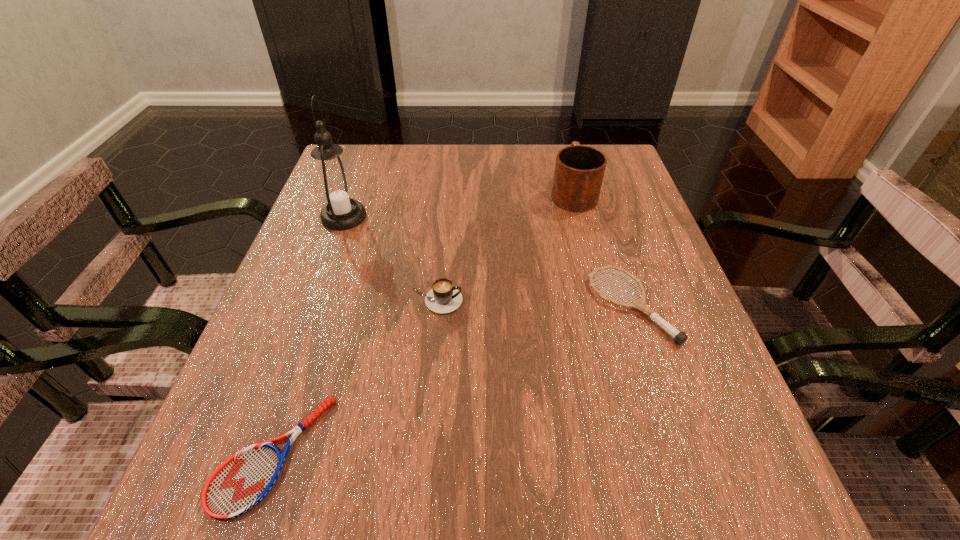
Where is `free space at the far edge of the desktop`? The height and width of the screenshot is (540, 960). free space at the far edge of the desktop is located at coordinates (492, 181).

At what (x,y) coordinates should I click in order to perform the action: click on free space at the near edge of the desktop. Please return your answer as a coordinate pair (x, y). The width and height of the screenshot is (960, 540). Looking at the image, I should click on (377, 471).

The image size is (960, 540). I want to click on vacant space at the left edge, so click(x=303, y=339).

In the image, there is a desktop. Where is `vacant space at the right edge`? vacant space at the right edge is located at coordinates (625, 312).

The width and height of the screenshot is (960, 540). In the image, there is a desktop. What are the coordinates of `free space at the far left corner` in the screenshot? It's located at (346, 165).

Find the location of a particular element. The width and height of the screenshot is (960, 540). blank area at the far right corner is located at coordinates (624, 158).

Where is `vacant area at the near right corner of the desktop`? The height and width of the screenshot is (540, 960). vacant area at the near right corner of the desktop is located at coordinates (709, 494).

At what (x,y) coordinates should I click in order to perform the action: click on unoccupied position between the mug and the left tennis racket. Please return your answer as a coordinate pair (x, y). The width and height of the screenshot is (960, 540). Looking at the image, I should click on (423, 323).

Identify the location of empty space between the tallest object and the shorter tennis racket. (308, 335).

Image resolution: width=960 pixels, height=540 pixels. Identify the location of unoccupied area between the right tennis racket and the oil lamp. (488, 261).